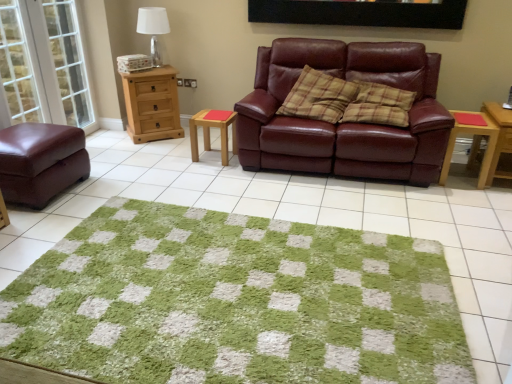
Question: From the image's perspective, is transparent glass door at left, placed as the 2th glass door when sorted from left to right, located above or below plaid fabric pillow at center, positioned as the second pillow in left-to-right order?

Choices:
 (A) above
 (B) below

Answer: (A)

Question: Is transparent glass door at left, placed as the 2th glass door when sorted from left to right, bigger or smaller than plaid fabric pillow at center, the first pillow positioned from the right?

Choices:
 (A) big
 (B) small

Answer: (B)

Question: Estimate the real-world distances between objects in this image. Which object is farther from the white fabric lampshade at upper left?

Choices:
 (A) wooden side table at right, the second table from the left
 (B) green shaggy rug at center
 (C) natural wood chest of drawers at left
 (D) transparent glass door at left, the 1th glass door in the right-to-left sequence
 (E) black matte picture frame at upper center

Answer: (A)

Question: Considering the real-world distances, which object is closest to the transparent glass door at left, the 1th glass door in the right-to-left sequence?

Choices:
 (A) wooden side table at right, which ranks as the second table in right-to-left order
 (B) green shaggy rug at center
 (C) clear glass door at left, which appears as the first glass door when viewed from the left
 (D) plaid fabric pillow at center, the second pillow from the right
 (E) burgundy leather ottoman at left

Answer: (C)